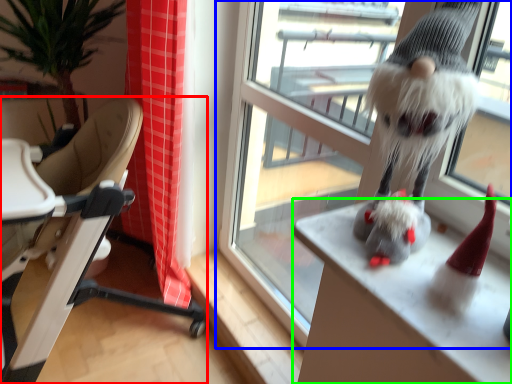
Question: Considering the real-world distances, which object is closest to chair (highlighted by a red box)? window (highlighted by a blue box) or desk (highlighted by a green box).

Choices:
 (A) window
 (B) desk

Answer: (A)